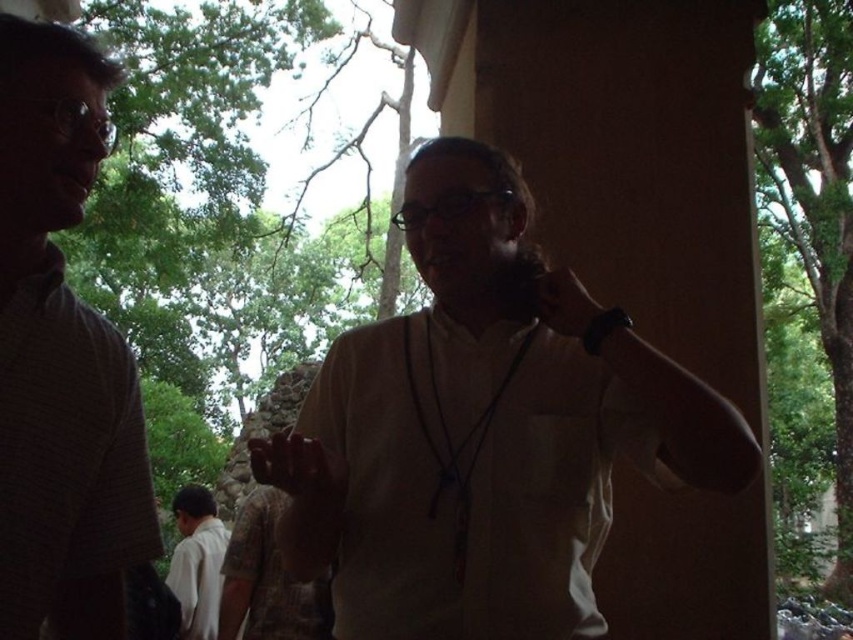
In order to click on matte gray shirt at left in this screenshot , I will do `click(61, 356)`.

Does matte gray shirt at left have a greater height compared to green leafy tree at upper left?

Indeed, matte gray shirt at left has a greater height compared to green leafy tree at upper left.

What do you see at coordinates (61, 356) in the screenshot? I see `matte gray shirt at left` at bounding box center [61, 356].

Identify the location of matte gray shirt at left. pos(61,356).

Between green leafy tree at upper left and white cotton shirt at lower left, which one appears on the right side from the viewer's perspective?

From the viewer's perspective, green leafy tree at upper left appears more on the right side.

Find the location of a particular element. Image resolution: width=853 pixels, height=640 pixels. green leafy tree at upper left is located at coordinates click(814, 196).

Is point (828, 3) positioned after point (206, 561)?

Yes.

The height and width of the screenshot is (640, 853). Find the location of `green leafy tree at upper left`. green leafy tree at upper left is located at coordinates (814, 196).

Does white matte shirt at center have a lesser width compared to green leafy tree at upper left?

Indeed, white matte shirt at center has a lesser width compared to green leafy tree at upper left.

The height and width of the screenshot is (640, 853). I want to click on white matte shirt at center, so click(x=483, y=429).